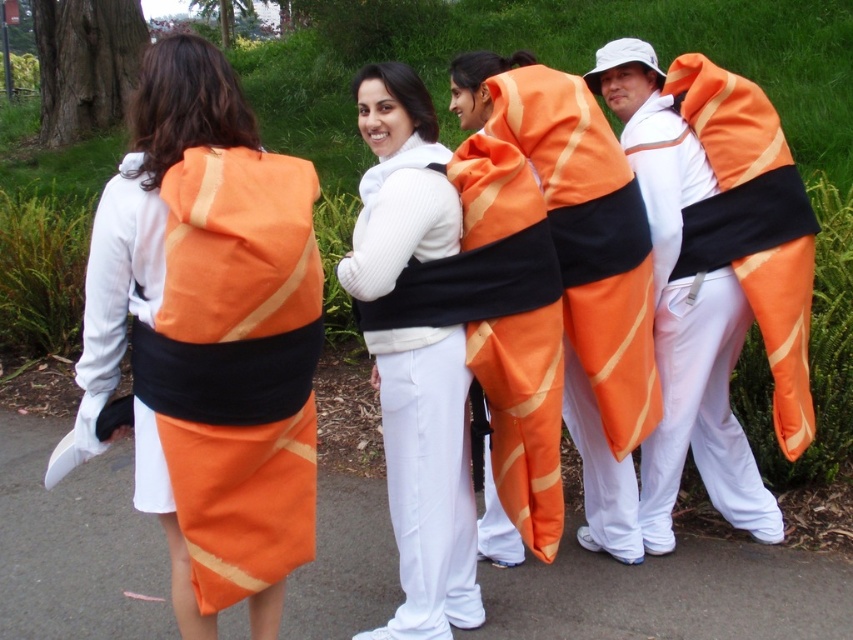
Question: Where is matte white sweater at center located in relation to matte orange sushi roll at center in the image?

Choices:
 (A) left
 (B) right

Answer: (A)

Question: Which object is the farthest from the matte orange kimono at center?

Choices:
 (A) matte orange sushi roll at center
 (B) matte white sweater at center

Answer: (A)

Question: Can you confirm if matte orange fabric sushi roll at back is wider than matte white sweater at center?

Choices:
 (A) yes
 (B) no

Answer: (A)

Question: Based on their relative distances, which object is farther from the matte orange sushi roll at center?

Choices:
 (A) matte white sweater at center
 (B) matte orange kimono at center
 (C) matte orange fabric sushi roll at back

Answer: (C)

Question: Which point appears farthest from the camera in this image?

Choices:
 (A) (427, 179)
 (B) (706, 253)
 (C) (486, 545)

Answer: (C)

Question: Considering the relative positions of matte white sweater at center and matte orange sushi roll at center in the image provided, where is matte white sweater at center located with respect to matte orange sushi roll at center?

Choices:
 (A) right
 (B) left

Answer: (B)